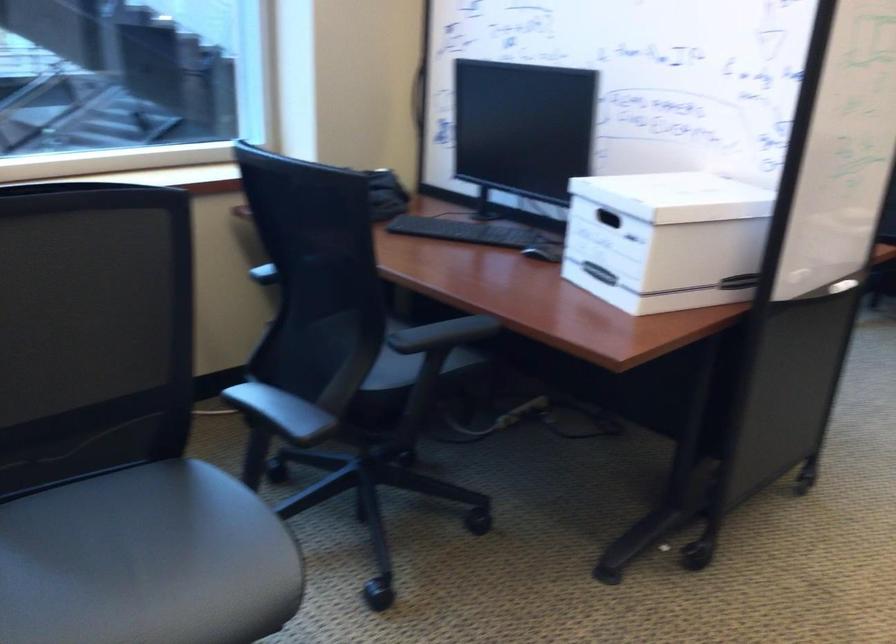
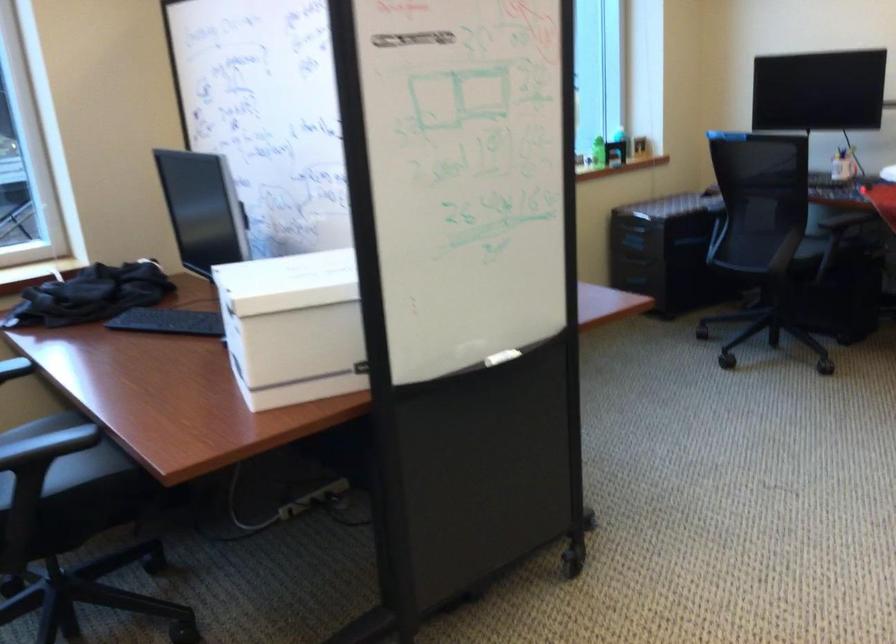
Question: The first image is from the beginning of the video and the second image is from the end. How did the camera likely rotate when shooting the video?

Choices:
 (A) Left
 (B) Right
 (C) Up
 (D) Down

Answer: (C)